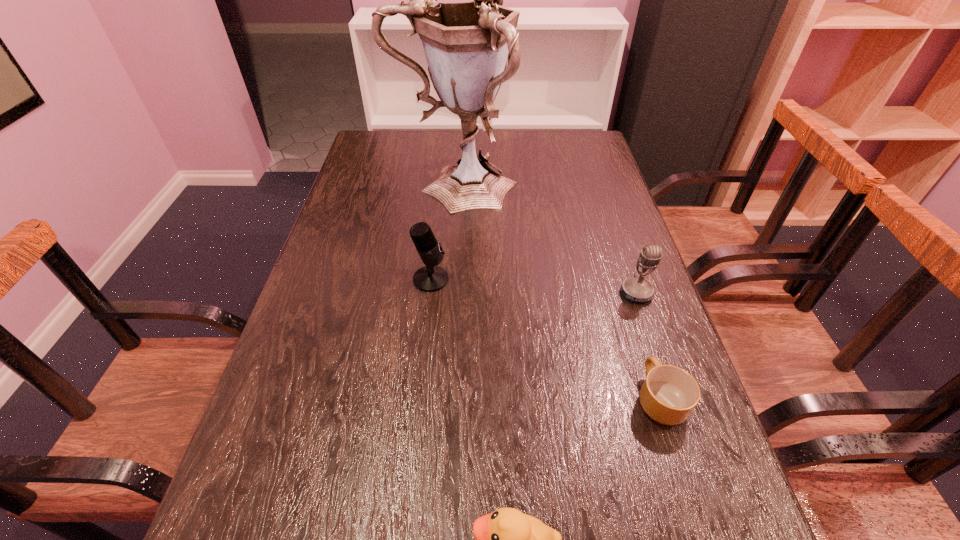
Where is `vacant space situated 0.050m on the side with the handle of the second nearest object`? vacant space situated 0.050m on the side with the handle of the second nearest object is located at coordinates [x=644, y=350].

Find the location of a particular element. Image resolution: width=960 pixels, height=540 pixels. free space located on the side with the handle of the second nearest object is located at coordinates (618, 271).

In order to click on object located at the far edge in this screenshot , I will do click(x=466, y=44).

Identify the location of object situated at the left edge. The height and width of the screenshot is (540, 960). (466, 44).

The image size is (960, 540). In order to click on microphone situated at the right edge in this screenshot , I will do `click(635, 289)`.

Find the location of a particular element. Image resolution: width=960 pixels, height=540 pixels. mug located at the right edge is located at coordinates (669, 394).

Where is `object that is at the far left corner`? object that is at the far left corner is located at coordinates (466, 44).

Locate an element on the screen. The width and height of the screenshot is (960, 540). vacant space at the left edge of the desktop is located at coordinates (323, 397).

Where is `vacant space at the right edge of the desktop`? The width and height of the screenshot is (960, 540). vacant space at the right edge of the desktop is located at coordinates (724, 529).

Locate an element on the screen. vacant space at the far right corner of the desktop is located at coordinates (571, 150).